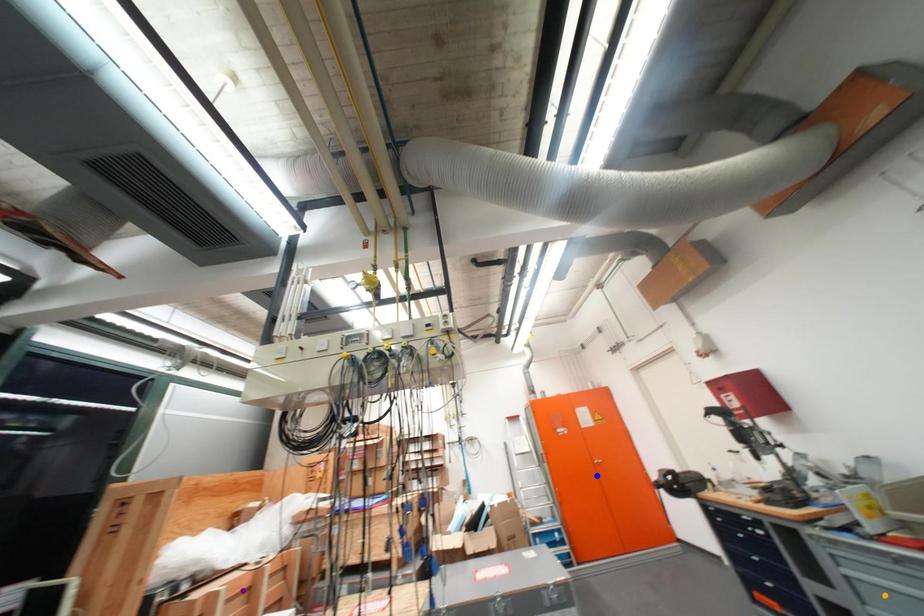
Consider the image. Order these from nearest to farthest:
blue point
purple point
orange point

orange point
purple point
blue point